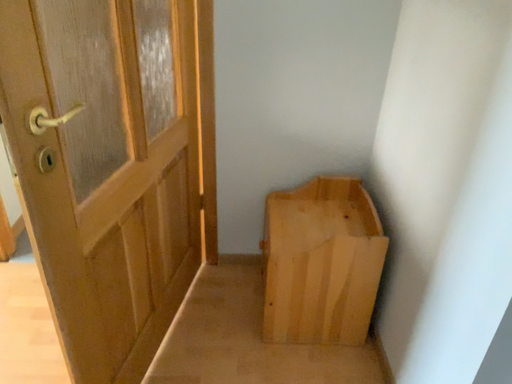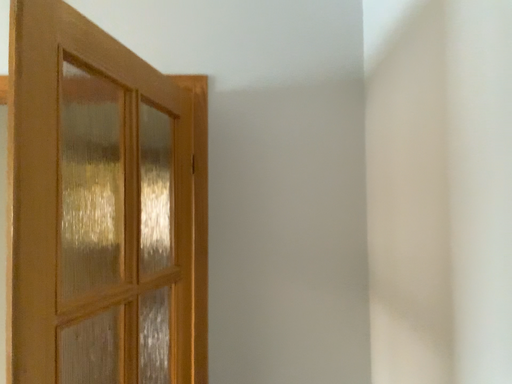
Question: How did the camera likely rotate when shooting the video?

Choices:
 (A) rotated upward
 (B) rotated downward

Answer: (A)